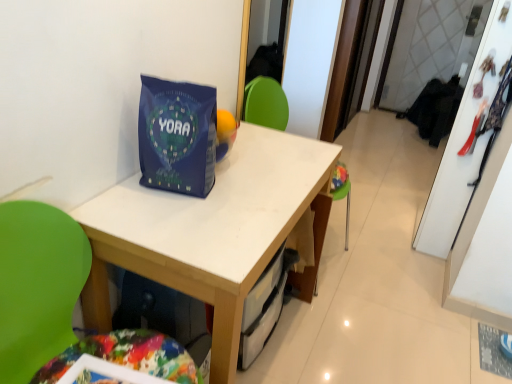
Question: From a real-world perspective, is blue matte gift bag at center on green plastic chair at center?

Choices:
 (A) no
 (B) yes

Answer: (B)

Question: Can you confirm if blue matte gift bag at center is bigger than green plastic chair at center?

Choices:
 (A) yes
 (B) no

Answer: (B)

Question: Is blue matte gift bag at center outside green plastic chair at center?

Choices:
 (A) yes
 (B) no

Answer: (A)

Question: Is blue matte gift bag at center smaller than green plastic chair at center?

Choices:
 (A) yes
 (B) no

Answer: (A)

Question: Considering the relative positions of blue matte gift bag at center and green plastic chair at center in the image provided, is blue matte gift bag at center to the left of green plastic chair at center from the viewer's perspective?

Choices:
 (A) yes
 (B) no

Answer: (B)

Question: From their relative heights in the image, would you say blue matte gift bag at center is taller or shorter than green plastic chair at center?

Choices:
 (A) short
 (B) tall

Answer: (A)

Question: In the image, is blue matte gift bag at center positioned in front of or behind green plastic chair at center?

Choices:
 (A) front
 (B) behind

Answer: (B)

Question: From a real-world perspective, relative to green plastic chair at center, is blue matte gift bag at center vertically above or below?

Choices:
 (A) above
 (B) below

Answer: (A)

Question: From the image's perspective, is blue matte gift bag at center located above or below green plastic chair at center?

Choices:
 (A) above
 (B) below

Answer: (A)

Question: Visually, is white matte table at center positioned to the left or to the right of green plastic chair at center?

Choices:
 (A) left
 (B) right

Answer: (B)

Question: From a real-world perspective, is white matte table at center physically located above or below green plastic chair at center?

Choices:
 (A) above
 (B) below

Answer: (B)

Question: Is point (216, 203) positioned closer to the camera than point (59, 264)?

Choices:
 (A) closer
 (B) farther

Answer: (B)

Question: From the image's perspective, is white matte table at center located above or below green plastic chair at center?

Choices:
 (A) above
 (B) below

Answer: (A)

Question: From the image's perspective, relative to blue matte gift bag at center, is white matte table at center above or below?

Choices:
 (A) below
 (B) above

Answer: (A)

Question: In the image, is white matte table at center positioned in front of or behind blue matte gift bag at center?

Choices:
 (A) behind
 (B) front

Answer: (B)